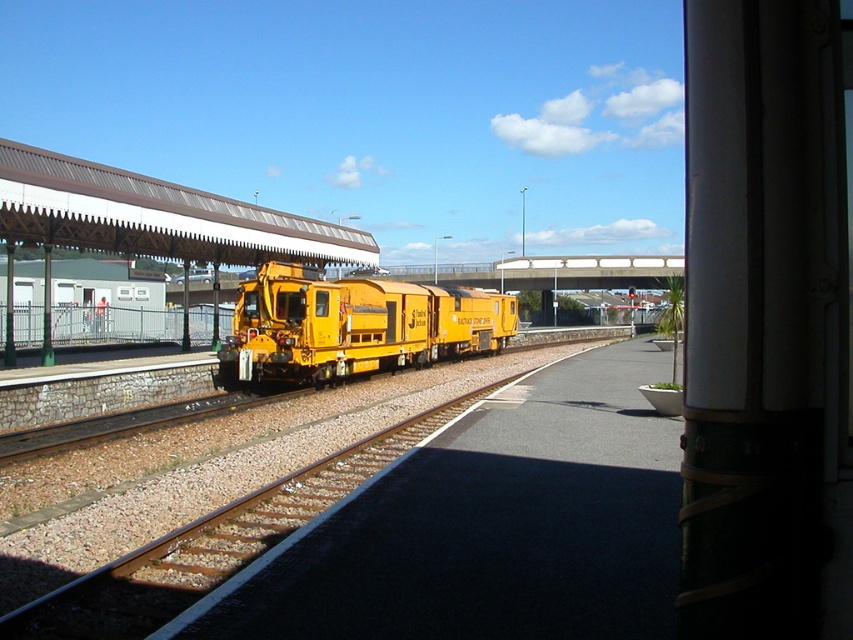
Question: Can you confirm if yellow metal train track at center is wider than yellow matte train at center?

Choices:
 (A) yes
 (B) no

Answer: (B)

Question: Which point appears closest to the camera in this image?

Choices:
 (A) (97, 595)
 (B) (393, 323)

Answer: (A)

Question: Can you confirm if yellow metal train track at center is positioned below yellow matte train at center?

Choices:
 (A) yes
 (B) no

Answer: (A)

Question: Among these points, which one is farthest from the camera?

Choices:
 (A) (291, 308)
 (B) (136, 621)

Answer: (A)

Question: Does yellow metal train track at center appear over yellow matte train at center?

Choices:
 (A) no
 (B) yes

Answer: (A)